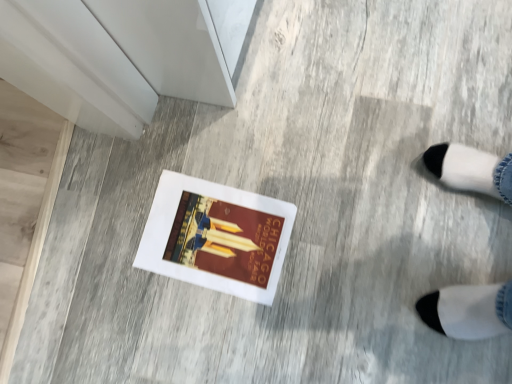
The width and height of the screenshot is (512, 384). Find the location of `empty space that is ontop of matte paper postcard at center (from a real-world perspective)`. empty space that is ontop of matte paper postcard at center (from a real-world perspective) is located at coordinates (212, 241).